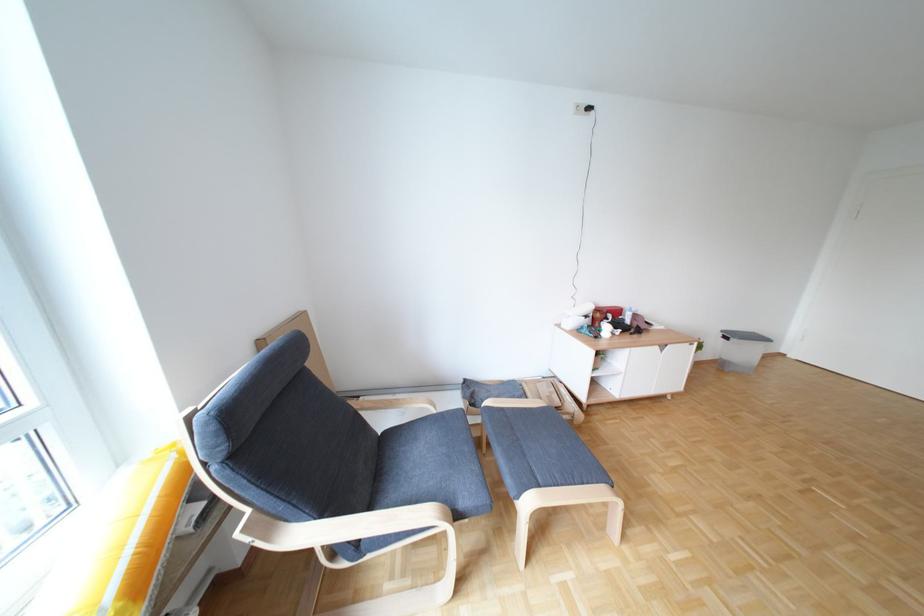
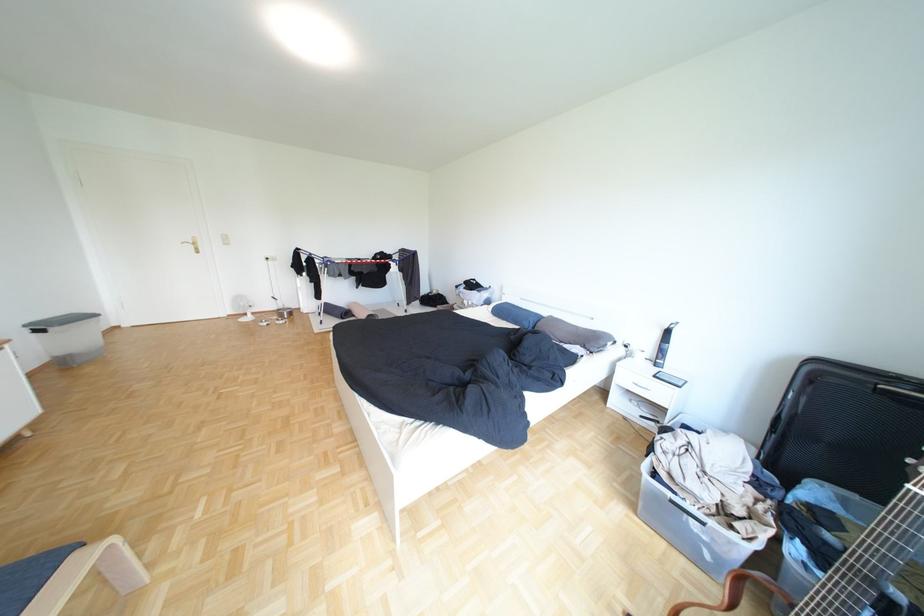
The point at (x=742, y=339) is marked in the first image. Where is the corresponding point in the second image?

(55, 331)